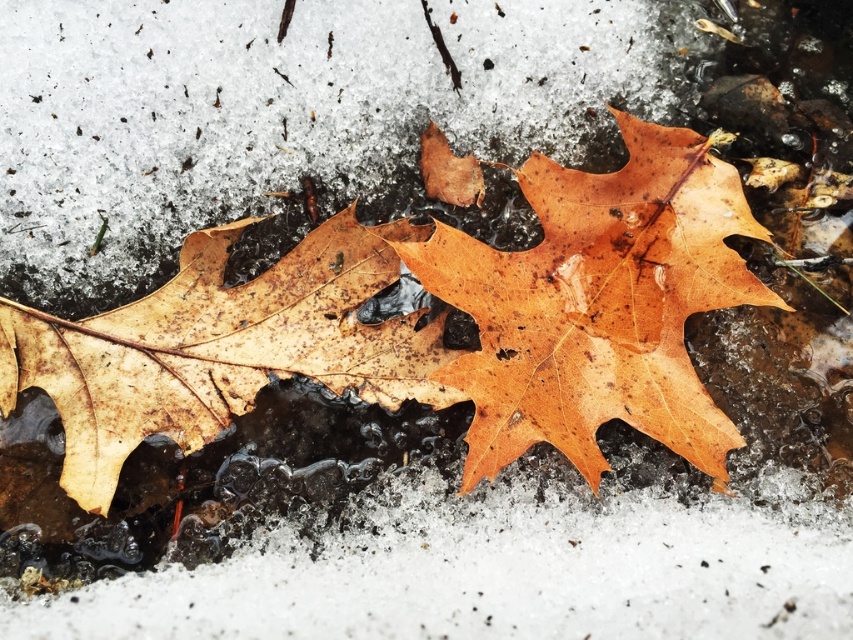
Does shiny brown leaf at center come in front of brown matte leaf at left?

No.

Who is more distant from viewer, (596, 401) or (206, 442)?

Positioned behind is point (206, 442).

Where is `shiny brown leaf at center`? This screenshot has width=853, height=640. shiny brown leaf at center is located at coordinates (598, 305).